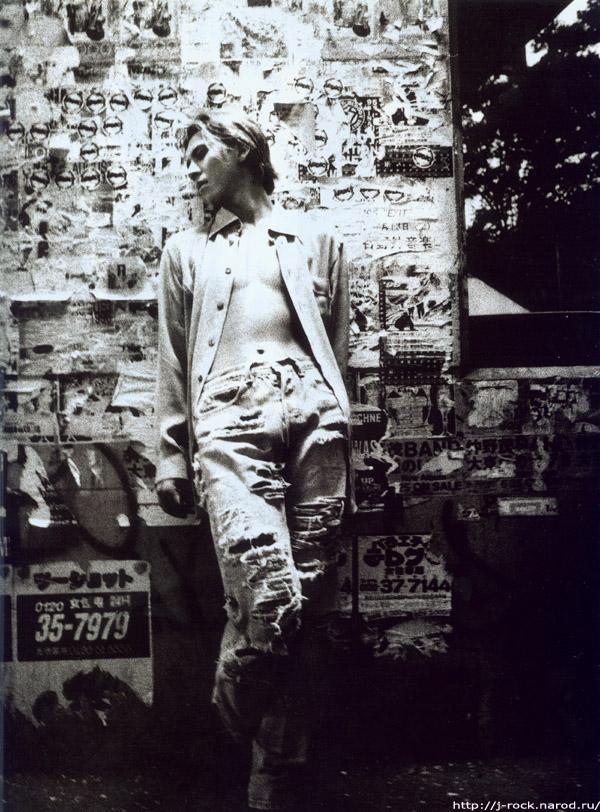
Where is `wall`? The width and height of the screenshot is (600, 812). wall is located at coordinates (288, 66).